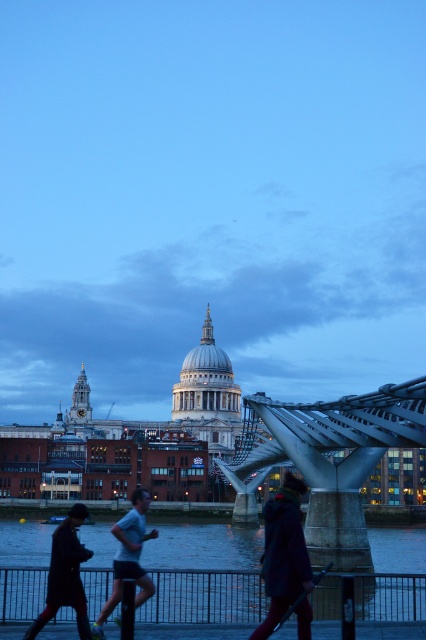
Is dark blue water at lower center to the right of dark brown leather coat at lower left from the viewer's perspective?

Correct, you'll find dark blue water at lower center to the right of dark brown leather coat at lower left.

Which of these two, dark blue water at lower center or dark brown leather coat at lower left, stands taller?

With more height is dark brown leather coat at lower left.

The width and height of the screenshot is (426, 640). I want to click on dark blue water at lower center, so click(204, 573).

Identify the location of dark blue water at lower center. The height and width of the screenshot is (640, 426). (204, 573).

You are a GUI agent. You are given a task and a screenshot of the screen. Output one action in this format:
    pyautogui.click(x=<x>, y=<y>)
    Task: Click on the polished steel suspension bridge at center
    
    Given the screenshot: What is the action you would take?
    pyautogui.click(x=331, y=458)

Which is behind, point (337, 518) or point (54, 570)?

Positioned behind is point (337, 518).

In order to click on polished steel suspension bridge at center in this screenshot , I will do `click(331, 458)`.

Who is more forward, (282,497) or (126,577)?

Point (126,577) is more forward.

Can you confirm if velvet purple coat at lower right is positioned to the right of light blue fabric shirt at center?

Correct, you'll find velvet purple coat at lower right to the right of light blue fabric shirt at center.

The width and height of the screenshot is (426, 640). Describe the element at coordinates (284, 554) in the screenshot. I see `velvet purple coat at lower right` at that location.

The image size is (426, 640). I want to click on velvet purple coat at lower right, so click(x=284, y=554).